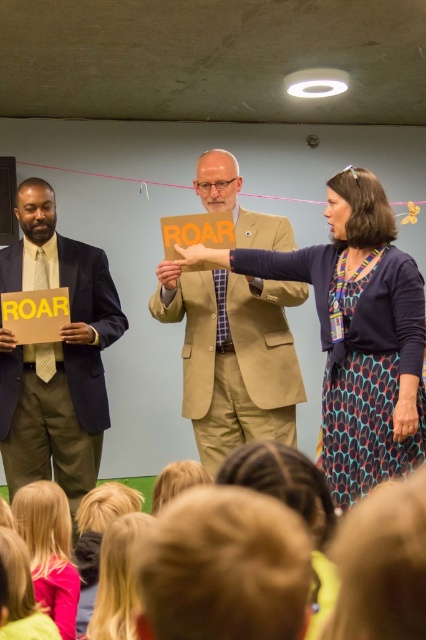
Question: Estimate the real-world distances between objects in this image. Which object is closer to the matte black suit at left?

Choices:
 (A) matte orange sign at center
 (B) tan fabric suit at center

Answer: (B)

Question: Is matte orange sign at center below tan fabric suit at center?

Choices:
 (A) no
 (B) yes

Answer: (B)

Question: Based on their relative distances, which object is nearer to the tan fabric suit at center?

Choices:
 (A) matte orange sign at center
 (B) matte black suit at left

Answer: (A)

Question: Can you confirm if matte orange sign at center is bigger than tan fabric suit at center?

Choices:
 (A) no
 (B) yes

Answer: (B)

Question: Which of the following is the closest to the observer?

Choices:
 (A) matte orange sign at center
 (B) tan fabric suit at center

Answer: (A)

Question: Is the position of matte orange sign at center less distant than that of tan fabric suit at center?

Choices:
 (A) yes
 (B) no

Answer: (A)